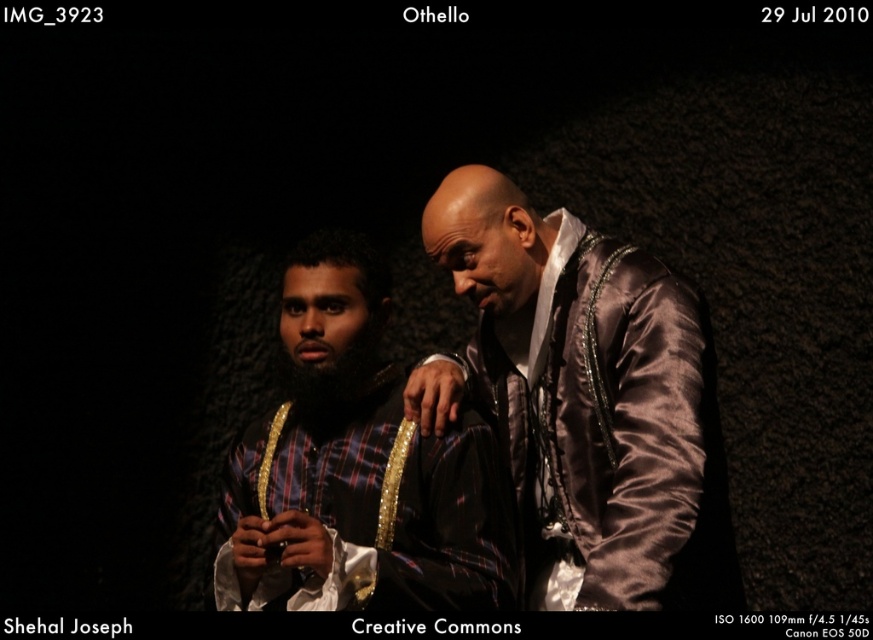
You are a stagehand preparing to place a 1.5 meters long decorative banner behind the satin brown jacket at center. Can you determine if the banner will fit behind the jacket without overlapping it?

The satin brown jacket at center is 1.29 meters from viewer. The banner is 1.5 meters long, so it will extend beyond the jacket and may overlap it depending on placement. Adjust positioning to ensure proper spacing.

Where is the satin brown jacket at center located in the image?

The satin brown jacket at center is located at point (585, 397).

Based on the scene described, which object, the satin brown jacket at center or the plaid fabric shirt at center, occupies a smaller horizontal space in the image?

The satin brown jacket at center has a lesser width compared to the plaid fabric shirt at center, so it occupies a smaller horizontal space.